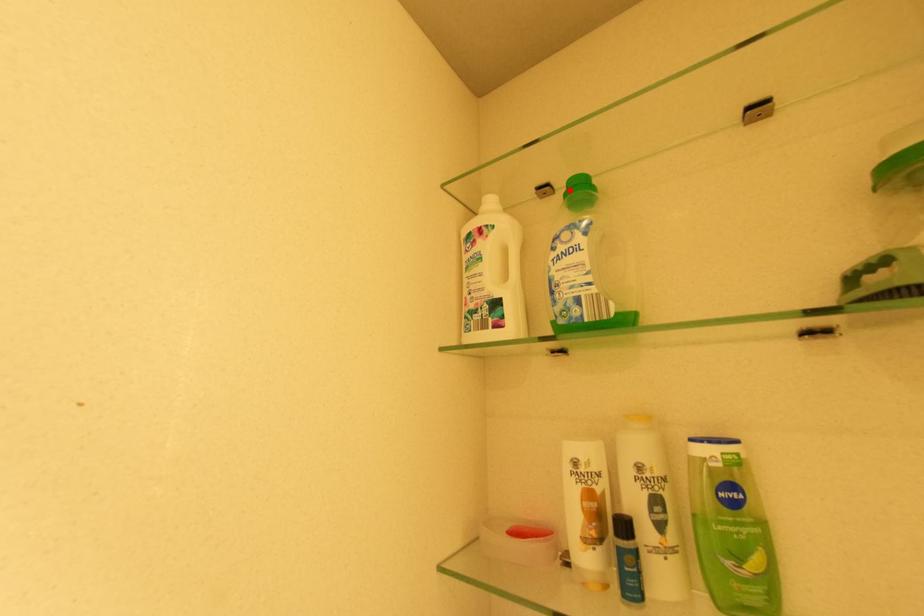
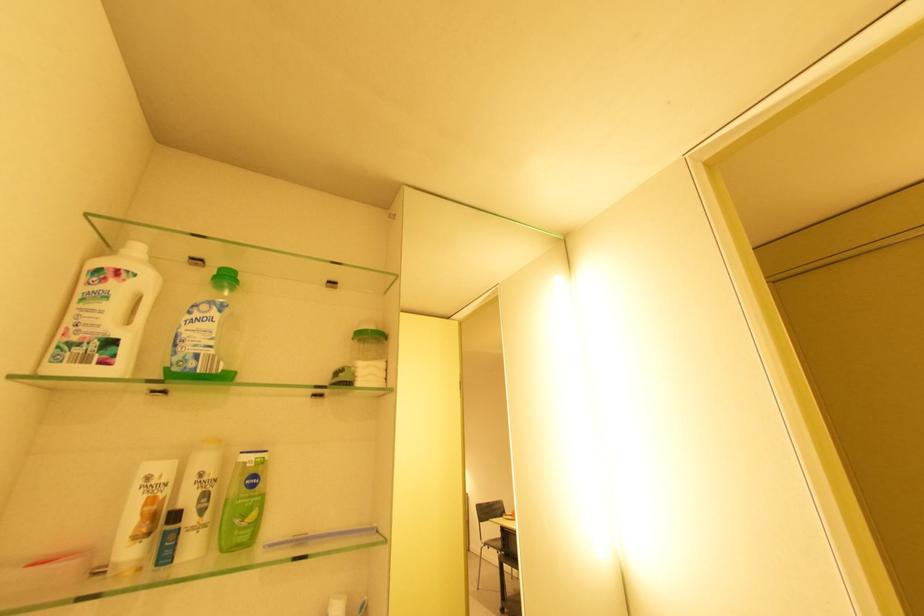
Locate, in the second image, the point that corresponds to the highlighted location in the first image.

(220, 273)